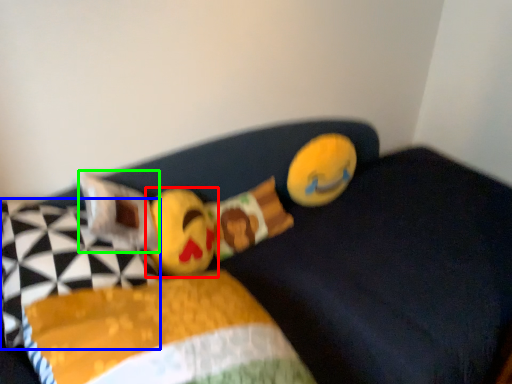
Question: Based on their relative distances, which object is nearer to toy (highlighted by a red box)? Choose from pillow (highlighted by a blue box) and pillow (highlighted by a green box).

Choices:
 (A) pillow
 (B) pillow

Answer: (B)